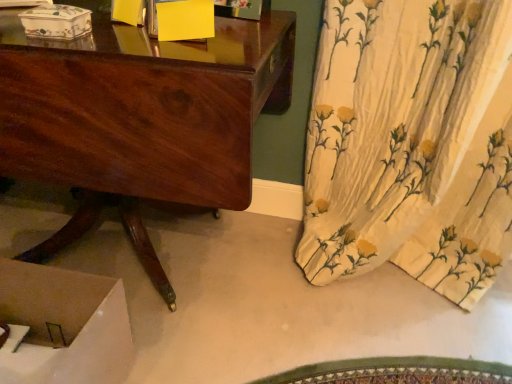
In order to click on vacant region in front of yellow paper at upper center, which appears as the second box when viewed from the right in this screenshot , I will do `click(112, 35)`.